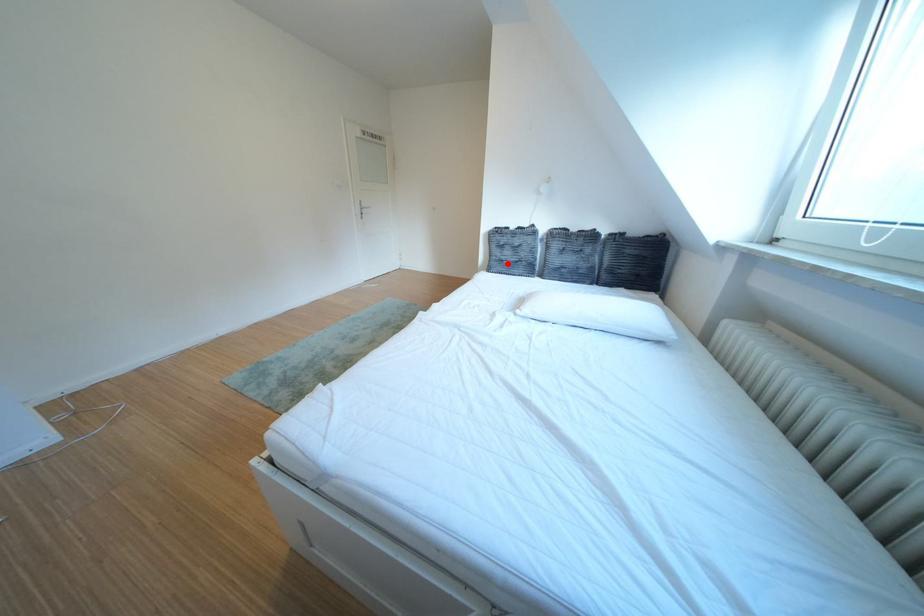
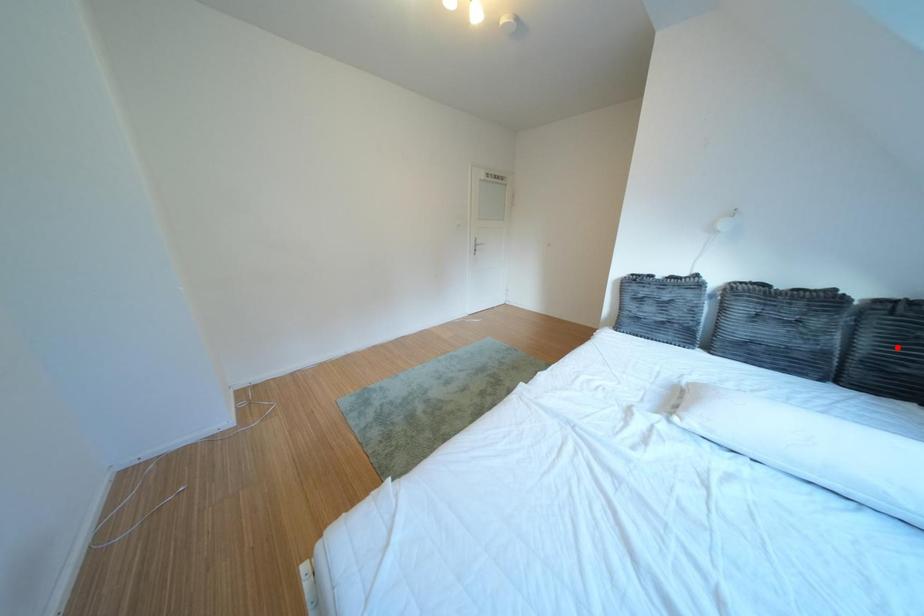
I am providing you with two images of the same scene from different viewpoints. A red point is marked on the first image and another point is marked on the second image. Are the points marked in image1 and image2 representing the same 3D position?

No